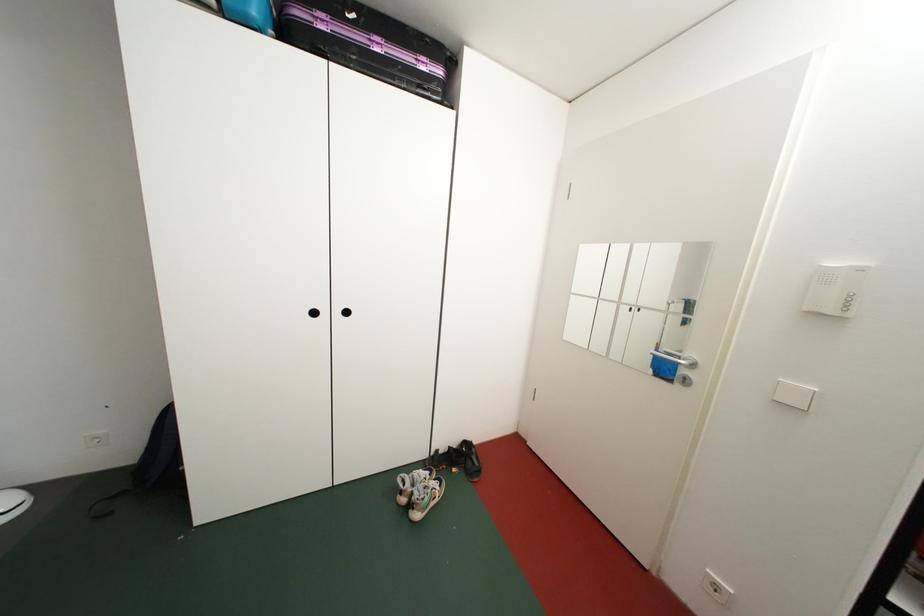
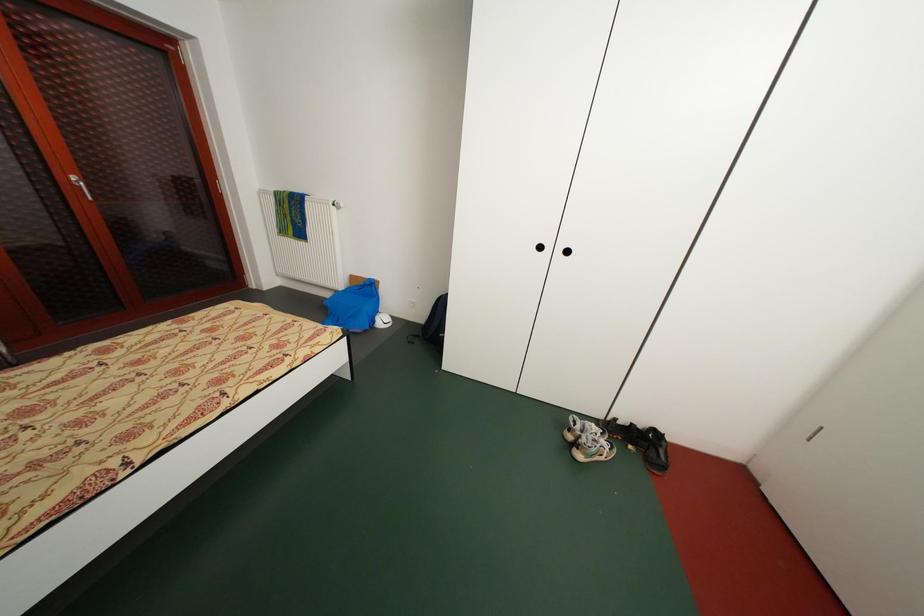
Question: How did the camera likely rotate?

Choices:
 (A) Left
 (B) Right
 (C) Up
 (D) Down

Answer: (A)